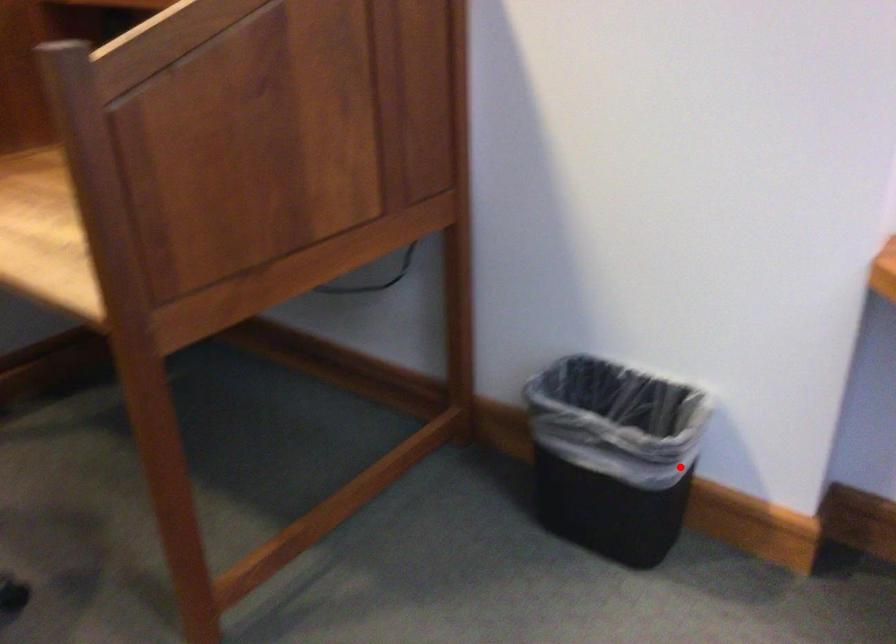
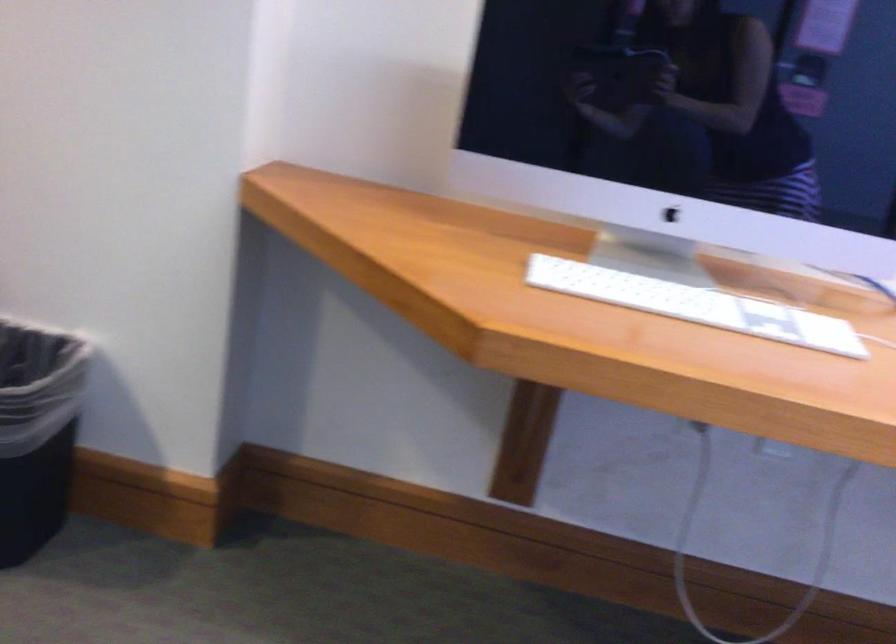
The point at the highlighted location is marked in the first image. Where is the corresponding point in the second image?

(37, 431)